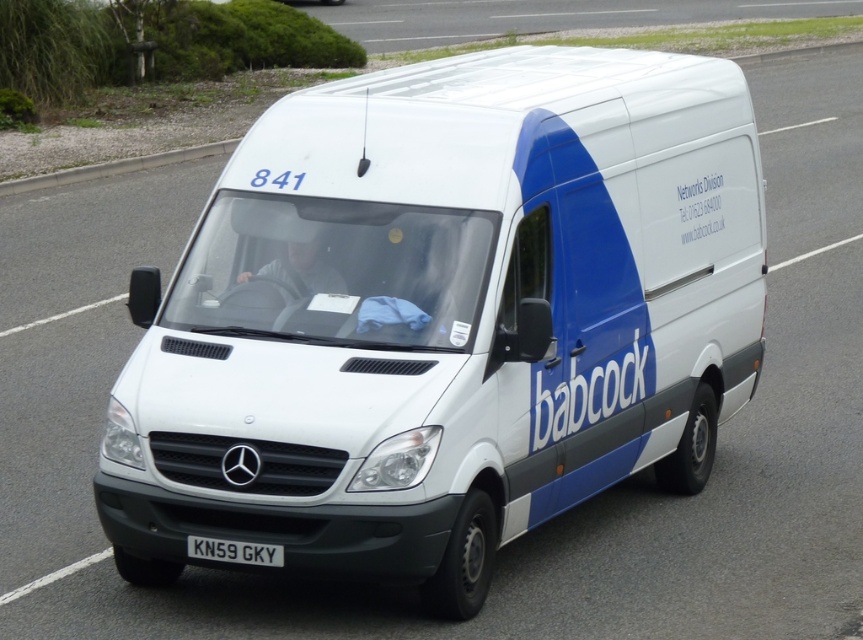
You are a delivery driver who needs to park the white matte van at center in a parking spot that is exactly the same width as the white metallic license plate at center. Will the van fit in the parking spot?

The white matte van at center is wider than the white metallic license plate at center, so it will not fit in the parking spot designed to match the license plate width.

What are the coordinates of the white matte van at center?

The white matte van at center is located at point (444, 316).